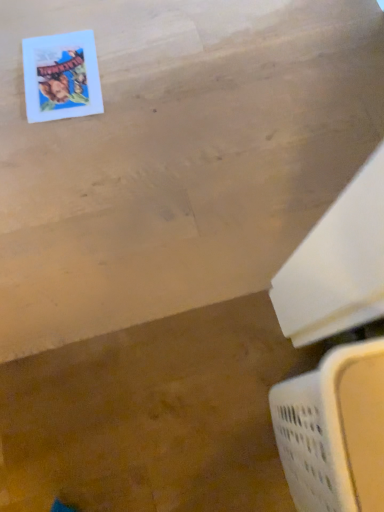
Find the location of a particular element. vacant space situated on the left part of matte paper comic book at upper left is located at coordinates click(11, 71).